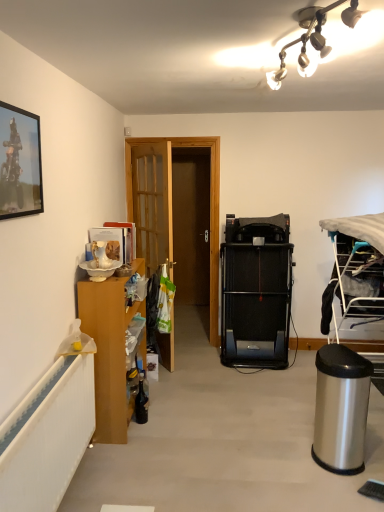
Describe the element at coordinates (341, 409) in the screenshot. I see `silver metallic trash can at lower right` at that location.

In order to face wooden cabinet at left, should I rotate leftwards or rightwards?

It's best to rotate left around 10.034 degrees.

At what (x,y) coordinates should I click in order to perform the action: click on silver metallic trash can at lower right. Please return your answer as a coordinate pair (x, y). Looking at the image, I should click on (355, 279).

In order to face metallic silver picture frame at upper left, should I rotate leftwards or rightwards?

You should rotate left by 22.295 degrees.

What do you see at coordinates (256, 291) in the screenshot?
I see `black rubber treadmill at center` at bounding box center [256, 291].

At what (x,y) coordinates should I click in order to perform the action: click on white glass light fixture at upper center. Please return your answer as a coordinate pair (x, y). Image resolution: width=384 pixels, height=512 pixels. Looking at the image, I should click on 305,42.

Could silver metallic trash can at lower right be considered to be inside wooden door at center?

Definitely not — silver metallic trash can at lower right is not inside wooden door at center.

From the image's perspective, which object appears higher, wooden door at center or silver metallic trash can at lower right?

wooden door at center is shown above in the image.

Can you tell me how much wooden door at center and silver metallic trash can at lower right differ in facing direction?

The angle between the facing direction of wooden door at center and the facing direction of silver metallic trash can at lower right is 145 degrees.

Measure the distance between wooden door at center and silver metallic trash can at lower right.

5.09 feet.

Are wooden door at center and metallic silver picture frame at upper left located far from each other?

Yes, wooden door at center is far from metallic silver picture frame at upper left.

Which of these two, wooden door at center or metallic silver picture frame at upper left, is bigger?

wooden door at center is bigger.

Is wooden door at center to the left of metallic silver picture frame at upper left from the viewer's perspective?

Incorrect, wooden door at center is not on the left side of metallic silver picture frame at upper left.

Could you tell me if white glass light fixture at upper center is facing metallic silver picture frame at upper left?

No.

From the image's perspective, would you say white glass light fixture at upper center is positioned over metallic silver picture frame at upper left?

Indeed, from the image's perspective, white glass light fixture at upper center is shown above metallic silver picture frame at upper left.

Is white glass light fixture at upper center not inside metallic silver picture frame at upper left?

Yes, white glass light fixture at upper center is outside of metallic silver picture frame at upper left.

Considering the relative sizes of white glass light fixture at upper center and metallic silver picture frame at upper left in the image provided, is white glass light fixture at upper center shorter than metallic silver picture frame at upper left?

Yes.

Considering the sizes of silver metallic trash can at lower right and silver metallic trash can at lower right in the image, is silver metallic trash can at lower right taller or shorter than silver metallic trash can at lower right?

silver metallic trash can at lower right is shorter than silver metallic trash can at lower right.

Where is `trash bin/can in front of the silver metallic trash can at lower right`? This screenshot has height=512, width=384. trash bin/can in front of the silver metallic trash can at lower right is located at coordinates (341, 409).

Is silver metallic trash can at lower right positioned far away from silver metallic trash can at lower right?

They are positioned close to each other.

Can you confirm if silver metallic trash can at lower right is thinner than silver metallic trash can at lower right?

Yes.

From the image's perspective, would you say wooden door at center is positioned over wooden cabinet at left?

Yes.

From a real-world perspective, is wooden door at center positioned above or below wooden cabinet at left?

In terms of real-world spatial position, wooden door at center is above wooden cabinet at left.

Which object is positioned more to the right, wooden door at center or wooden cabinet at left?

wooden door at center is more to the right.

Can you confirm if wooden door at center is thinner than wooden cabinet at left?

Yes.

Could you tell me if white glass light fixture at upper center is facing silver metallic trash can at lower right?

No, white glass light fixture at upper center is not turned towards silver metallic trash can at lower right.

Can you tell me how much white glass light fixture at upper center and silver metallic trash can at lower right differ in facing direction?

The angular difference between white glass light fixture at upper center and silver metallic trash can at lower right is 100 degrees.

From the image's perspective, would you say white glass light fixture at upper center is shown under silver metallic trash can at lower right?

No, from the image's perspective, white glass light fixture at upper center is not beneath silver metallic trash can at lower right.

From a real-world perspective, is white glass light fixture at upper center positioned above or below silver metallic trash can at lower right?

From a real-world perspective, white glass light fixture at upper center is physically above silver metallic trash can at lower right.

Is metallic silver picture frame at upper left situated inside wooden cabinet at left or outside?

metallic silver picture frame at upper left lies outside wooden cabinet at left.

Which object is closer to the camera taking this photo, metallic silver picture frame at upper left or wooden cabinet at left?

metallic silver picture frame at upper left.

From a real-world perspective, is metallic silver picture frame at upper left physically located above or below wooden cabinet at left?

From a real-world perspective, metallic silver picture frame at upper left is physically above wooden cabinet at left.

The width and height of the screenshot is (384, 512). Identify the location of door located above the silver metallic trash can at lower right (from the image's perspective). (150, 199).

At what (x,y) coordinates should I click in order to perform the action: click on picture frame located above the wooden door at center (from a real-world perspective). Please return your answer as a coordinate pair (x, y). This screenshot has height=512, width=384. Looking at the image, I should click on (20, 163).

Consider the image. Estimate the real-world distances between objects in this image. Which object is closer to metallic silver picture frame at upper left, silver metallic trash can at lower right or wooden door at center?

wooden door at center lies closer to metallic silver picture frame at upper left than the other object.

Which object lies further to the anchor point wooden door at center, silver metallic trash can at lower right or metallic silver picture frame at upper left?

metallic silver picture frame at upper left is further to wooden door at center.

Based on their spatial positions, is wooden door at center or silver metallic trash can at lower right closer to silver metallic trash can at lower right?

silver metallic trash can at lower right is closer to silver metallic trash can at lower right.

Which object lies nearer to the anchor point wooden cabinet at left, silver metallic trash can at lower right or white glass light fixture at upper center?

Among the two, silver metallic trash can at lower right is located nearer to wooden cabinet at left.

Which object lies further to the anchor point black rubber treadmill at center, metallic silver picture frame at upper left or wooden door at center?

metallic silver picture frame at upper left is positioned further to the anchor black rubber treadmill at center.

Looking at this image, which object lies further to the anchor point white glass light fixture at upper center, black rubber treadmill at center or wooden door at center?

Among the two, black rubber treadmill at center is located further to white glass light fixture at upper center.

Looking at this image, considering their positions, is white glass light fixture at upper center positioned closer to silver metallic trash can at lower right than wooden door at center?

Among the two, white glass light fixture at upper center is located nearer to silver metallic trash can at lower right.

Estimate the real-world distances between objects in this image. Which object is further from metallic silver picture frame at upper left, black rubber treadmill at center or silver metallic trash can at lower right?

black rubber treadmill at center lies further to metallic silver picture frame at upper left than the other object.

You are a GUI agent. You are given a task and a screenshot of the screen. Output one action in this format:
    pyautogui.click(x=<x>, y=<y>)
    Task: Click on the lamp situated between wooden cabinet at left and silver metallic trash can at lower right from left to right
    The height and width of the screenshot is (512, 384).
    Given the screenshot: What is the action you would take?
    pyautogui.click(x=305, y=42)

This screenshot has width=384, height=512. I want to click on desk positioned between white glass light fixture at upper center and black rubber treadmill at center from near to far, so click(x=355, y=279).

Find the location of a particular element. The height and width of the screenshot is (512, 384). bunk bed situated between metallic silver picture frame at upper left and silver metallic trash can at lower right from left to right is located at coordinates (256, 291).

Find the location of `desk between white glass light fixture at upper center and silver metallic trash can at lower right from top to bottom`. desk between white glass light fixture at upper center and silver metallic trash can at lower right from top to bottom is located at coordinates (355, 279).